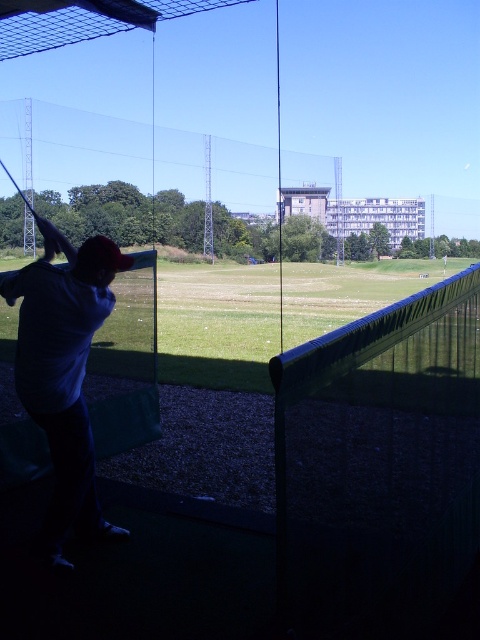
You are standing at the back of the driving range and want to walk to the green grass at center. Is the dark blue shirt at left blocking your path?

The green grass at center is above the dark blue shirt at left, so the dark blue shirt at left is not blocking your path.

You are a golfer preparing to hit a ball at the driving range. You notice the green grass at center and the dark blue shirt at left. Which object is taller?

The green grass at center is much taller than the dark blue shirt at left.